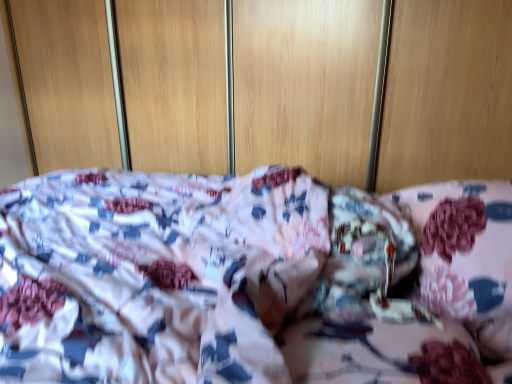
Question: Based on their sizes in the image, would you say fluffy pink pillow at right is bigger or smaller than wooden dresser at center?

Choices:
 (A) small
 (B) big

Answer: (A)

Question: Looking at their shapes, would you say fluffy pink pillow at right is wider or thinner than wooden dresser at center?

Choices:
 (A) thin
 (B) wide

Answer: (B)

Question: From the image's perspective, relative to wooden dresser at center, is fluffy pink pillow at right above or below?

Choices:
 (A) above
 (B) below

Answer: (B)

Question: Looking at their shapes, would you say wooden dresser at center is wider or thinner than fluffy pink pillow at right?

Choices:
 (A) wide
 (B) thin

Answer: (B)

Question: From a real-world perspective, is wooden dresser at center positioned above or below fluffy pink pillow at right?

Choices:
 (A) above
 (B) below

Answer: (A)

Question: In terms of height, does wooden dresser at center look taller or shorter compared to fluffy pink pillow at right?

Choices:
 (A) short
 (B) tall

Answer: (B)

Question: Considering the positions of wooden dresser at center and fluffy pink pillow at right in the image, is wooden dresser at center bigger or smaller than fluffy pink pillow at right?

Choices:
 (A) small
 (B) big

Answer: (B)